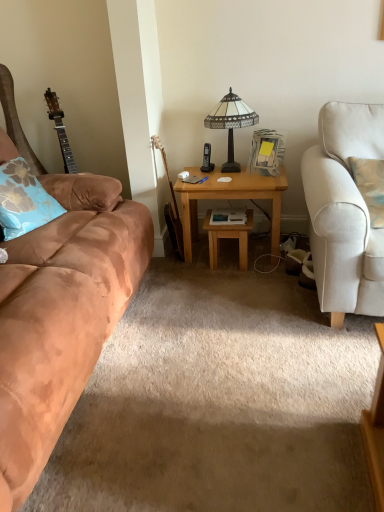
The image size is (384, 512). In order to click on free spot in front of wooden acoustic guitar at center in this screenshot , I will do `click(182, 268)`.